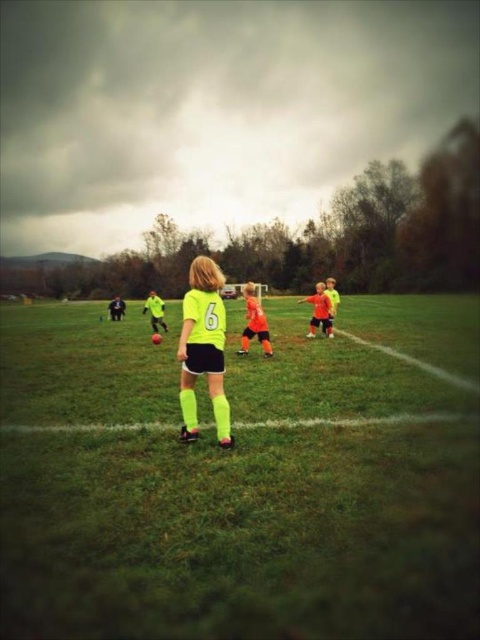
You are a referee observing the soccer game. You notice two players wearing neon yellow jersey at center and orange matte soccer jersey at center. Which player is positioned closer to you?

The neon yellow jersey at center is closer to the viewer than the orange matte soccer jersey at center, so the player wearing the neon yellow jersey at center is positioned closer to you.